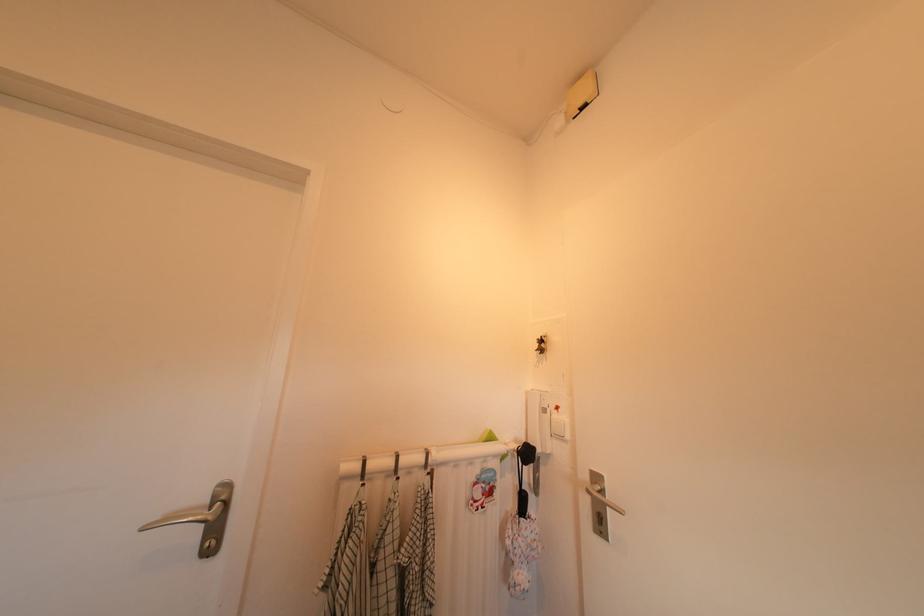
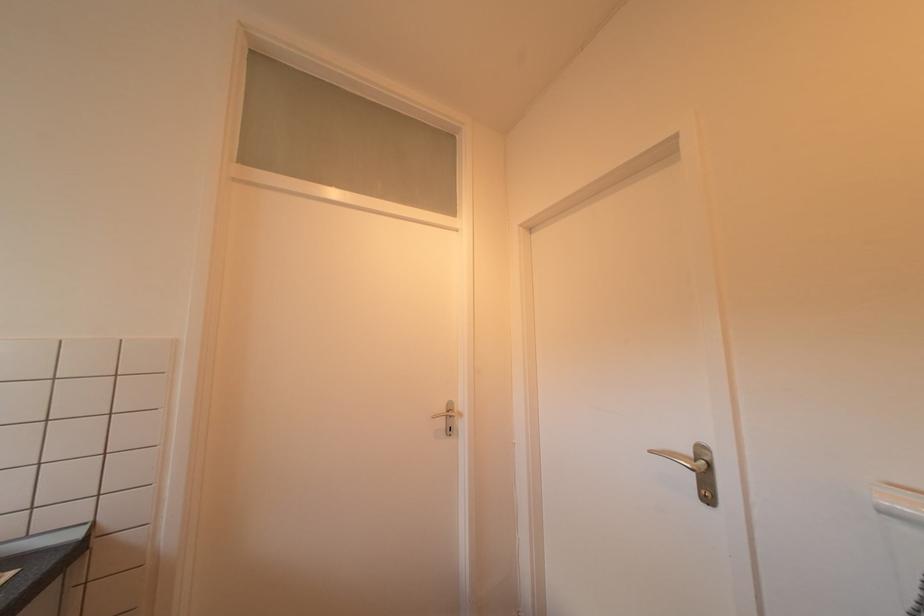
Question: The camera is either moving clockwise (left) or counter-clockwise (right) around the object. The first image is from the beginning of the video and the second image is from the end. Is the camera moving left or right when shooting the video?

Choices:
 (A) Left
 (B) Right

Answer: (B)